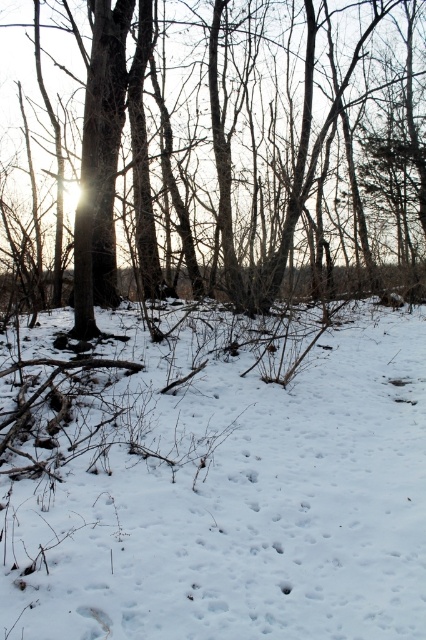
Does point (23, 608) come farther from viewer compared to point (207, 51)?

No, (23, 608) is closer to viewer.

Is white powdery snow at center above brown rough tree at center?

No, white powdery snow at center is not above brown rough tree at center.

Describe the element at coordinates (222, 490) in the screenshot. I see `white powdery snow at center` at that location.

Where is `white powdery snow at center`? Image resolution: width=426 pixels, height=640 pixels. white powdery snow at center is located at coordinates (222, 490).